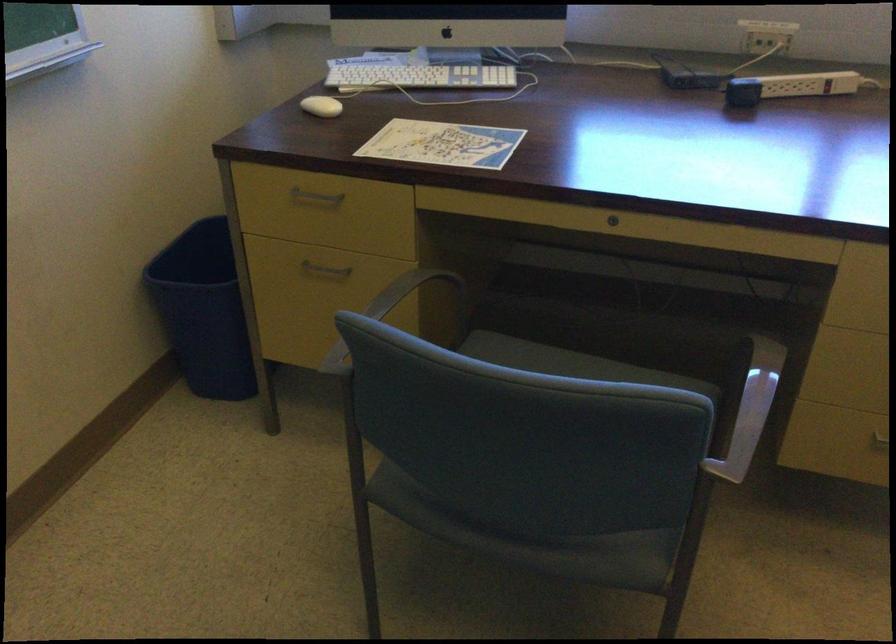
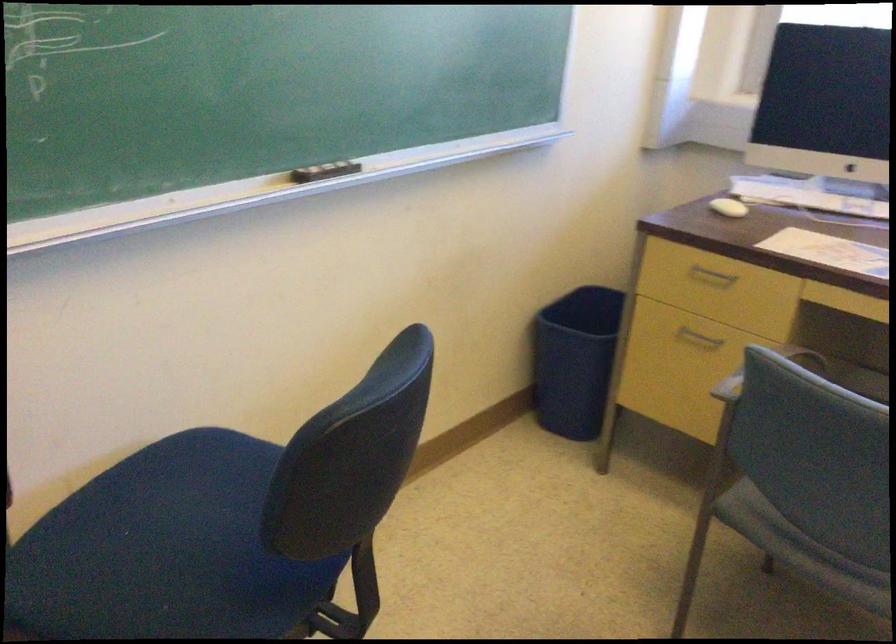
In the second image, find the point that corresponds to (x=314, y=113) in the first image.

(728, 207)